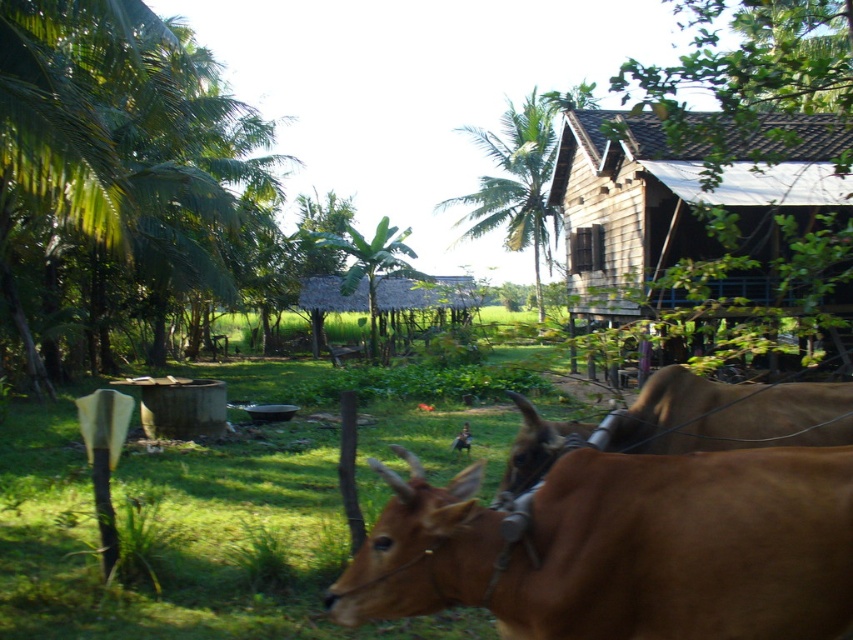
Which is more to the right, wooden hut at upper right or green leafy palm tree at center?

wooden hut at upper right is more to the right.

Find the location of a particular element. This screenshot has height=640, width=853. wooden hut at upper right is located at coordinates (671, 205).

The height and width of the screenshot is (640, 853). In order to click on wooden hut at upper right in this screenshot , I will do `click(671, 205)`.

Based on the photo, can you confirm if green grass at center is shorter than brown smooth cow at lower right?

Incorrect, green grass at center's height does not fall short of brown smooth cow at lower right's.

The width and height of the screenshot is (853, 640). I want to click on green grass at center, so click(183, 532).

The height and width of the screenshot is (640, 853). I want to click on green grass at center, so click(183, 532).

The image size is (853, 640). What are the coordinates of `brown glossy bull at center` in the screenshot? It's located at (730, 413).

Can you confirm if brown glossy bull at center is positioned above green leafy palm tree at upper center?

No, brown glossy bull at center is not above green leafy palm tree at upper center.

Image resolution: width=853 pixels, height=640 pixels. What do you see at coordinates (730, 413) in the screenshot?
I see `brown glossy bull at center` at bounding box center [730, 413].

This screenshot has width=853, height=640. I want to click on brown glossy bull at center, so click(730, 413).